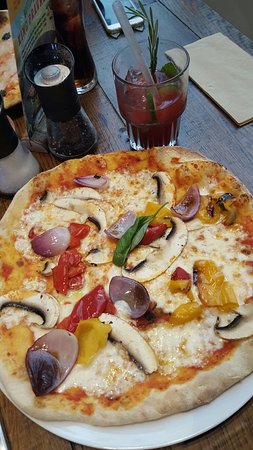
At what (x,y) coordinates should I click in order to perform the action: click on empty space on table. Please return your answer as a coordinate pair (x, y). The width and height of the screenshot is (253, 450). Looking at the image, I should click on (25, 432).